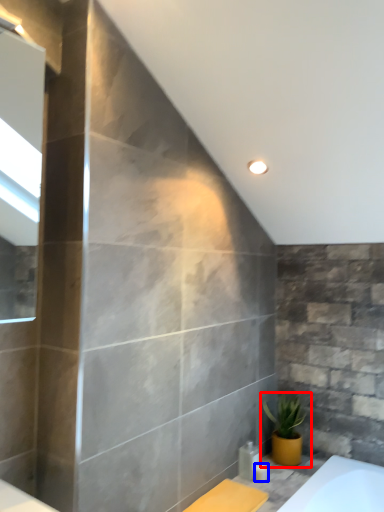
Question: Which point is closer to the camera, houseplant (highlighted by a red box) or toiletry (highlighted by a blue box)?

Choices:
 (A) houseplant
 (B) toiletry

Answer: (B)